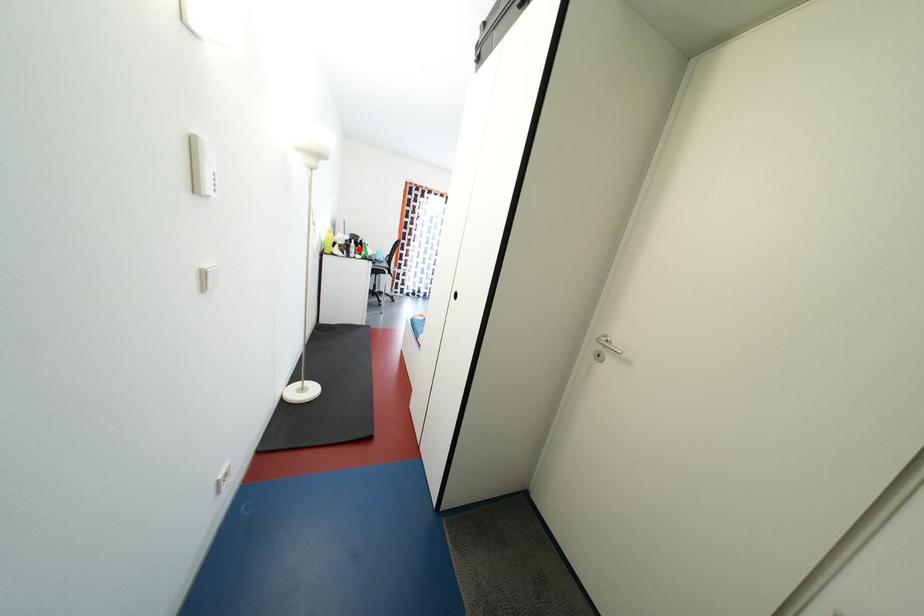
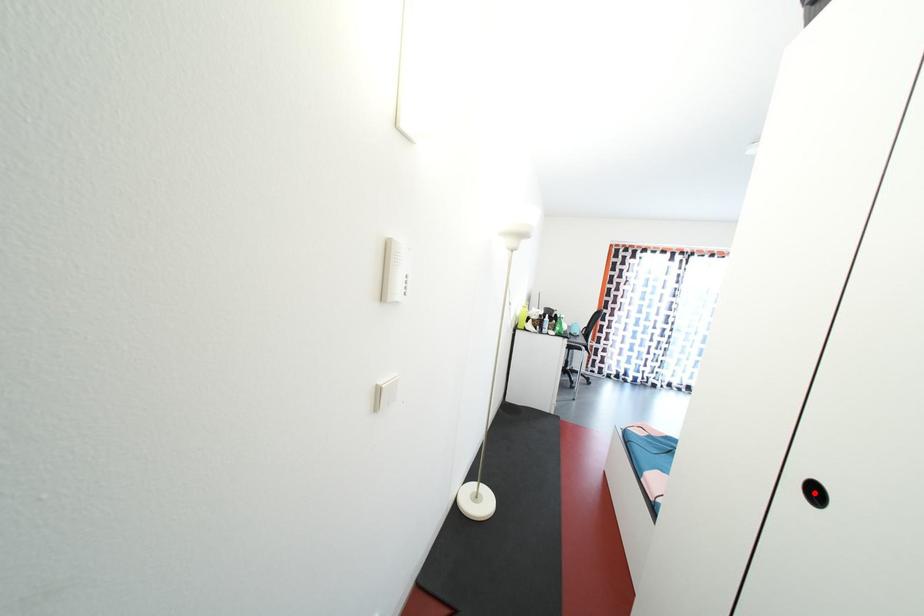
I am providing you with two images of the same scene from different viewpoints. A red point is marked on the first image and another point is marked on the second image. Is the marked point in image1 the same physical position as the marked point in image2?

No